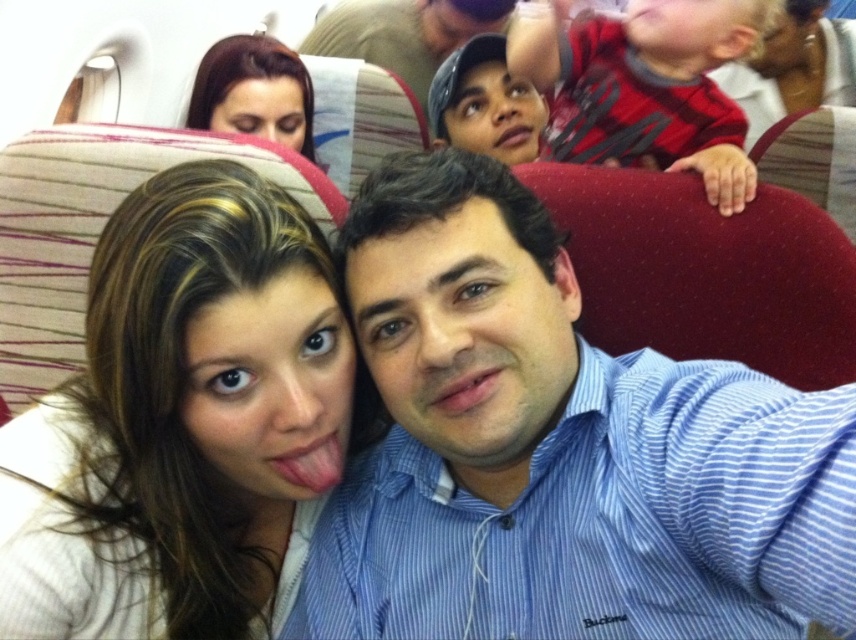
You are a flight attendant looking for two caps in the airplane cabin. According to the scene, where are the matte brown cap at upper center and the matte black cap at upper center located in relation to each other?

The matte brown cap at upper center is located to the left of the matte black cap at upper center.

You are a passenger seated in the airplane cabin and want to know if the matte brown cap at upper center is positioned higher than the smooth brown hair at upper left. Can you confirm this based on your observation?

The matte brown cap at upper center is above smooth brown hair at upper left, so yes, it is positioned higher.

In the scene shown: You are standing at the point marked as point (535, 10) in the airplane cabin. You want to reach the emergency exit, which is located 3 meters behind you. Can you walk straight from your current position to the exit without encountering any obstacles?

The distance between you and the viewer is 1.64 meters, so you cannot reach the emergency exit located 3 meters behind you without moving further back.